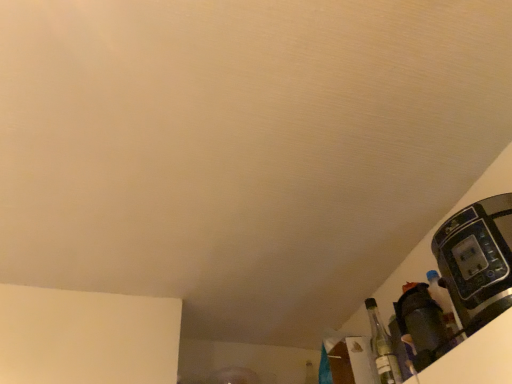
Question: From the image's perspective, relative to matte black coffee maker at lower right, is black plastic coffee machine at right above or below?

Choices:
 (A) below
 (B) above

Answer: (B)

Question: Does point pos(471,301) appear closer or farther from the camera than point pos(425,347)?

Choices:
 (A) farther
 (B) closer

Answer: (B)

Question: Estimate the real-world distances between objects in this image. Which object is farther from the black plastic coffee machine at right?

Choices:
 (A) clear glass bottle at lower right
 (B) matte black coffee maker at lower right

Answer: (A)

Question: Which of these objects is positioned farthest from the black plastic coffee machine at right?

Choices:
 (A) clear glass bottle at lower right
 (B) matte black coffee maker at lower right

Answer: (A)